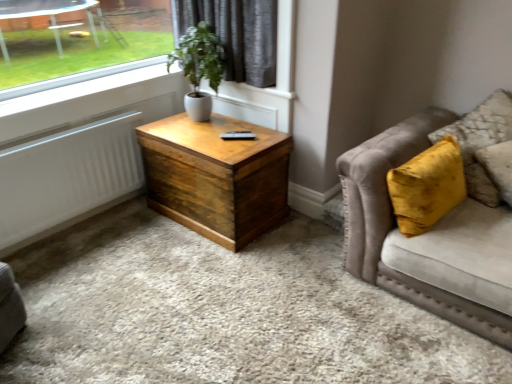
In order to face white ceramic pot at upper center, should I rotate leftwards or rightwards?

Turn left by 7.869 degrees to look at white ceramic pot at upper center.

This screenshot has height=384, width=512. What do you see at coordinates (199, 67) in the screenshot?
I see `white ceramic pot at upper center` at bounding box center [199, 67].

Measure the distance between wooden chest at center and camera.

wooden chest at center and camera are 2.24 meters apart.

This screenshot has height=384, width=512. In order to click on velvet yellow pillow at right in this screenshot , I will do `click(481, 142)`.

What's the angular difference between white ceramic pot at upper center and velvet yellow pillow at right's facing directions?

22.1 degrees.

From the image's perspective, is white ceramic pot at upper center beneath velvet yellow pillow at right?

Actually, white ceramic pot at upper center appears above velvet yellow pillow at right in the image.

Considering the relative sizes of white ceramic pot at upper center and velvet yellow pillow at right in the image provided, is white ceramic pot at upper center taller than velvet yellow pillow at right?

Incorrect, the height of white ceramic pot at upper center is not larger of that of velvet yellow pillow at right.

Is white ceramic pot at upper center to the left of velvet yellow pillow at right from the viewer's perspective?

Correct, you'll find white ceramic pot at upper center to the left of velvet yellow pillow at right.

Which of these two, velvet beige couch at right or white ceramic pot at upper center, stands shorter?

white ceramic pot at upper center.

Is velvet beige couch at right positioned with its back to white ceramic pot at upper center?

velvet beige couch at right is not turned away from white ceramic pot at upper center.

From the image's perspective, relative to white ceramic pot at upper center, is velvet beige couch at right above or below?

From the image's perspective, velvet beige couch at right appears below white ceramic pot at upper center.

Which of these two, wooden chest at center or velvet beige couch at right, is bigger?

velvet beige couch at right.

Choose the correct answer: Is wooden chest at center inside velvet beige couch at right or outside it?

wooden chest at center is spatially situated outside velvet beige couch at right.

Which is more to the right, wooden chest at center or velvet beige couch at right?

velvet beige couch at right.

From a real-world perspective, which object stands above the other?

From a 3D spatial view, velvet beige couch at right is above.

Which object is closer to the camera, wooden chest at center or velvet yellow pillow at right?

Positioned in front is velvet yellow pillow at right.

Consider the image. Which is nearer, (230, 159) or (479, 186)?

Clearly, point (230, 159) is more distant from the camera than point (479, 186).

From the image's perspective, which one is positioned lower, wooden chest at center or velvet yellow pillow at right?

From the image's view, wooden chest at center is below.

Consider the image. Does wooden chest at center have a lesser width compared to white matte radiator at left?

Incorrect, the width of wooden chest at center is not less than that of white matte radiator at left.

Consider the image. From their relative heights in the image, would you say wooden chest at center is taller or shorter than white matte radiator at left?

wooden chest at center is taller than white matte radiator at left.

Is wooden chest at center bigger than white matte radiator at left?

Yes.

Looking at this image, from the image's perspective, is wooden chest at center on top of white matte radiator at left?

Yes, from the image's perspective, wooden chest at center is above white matte radiator at left.

Can you confirm if velvet beige couch at right is positioned to the right of velvet yellow pillow at right?

No, velvet beige couch at right is not to the right of velvet yellow pillow at right.

How far apart are velvet beige couch at right and velvet yellow pillow at right?

10.18 inches.

Considering the relative sizes of velvet beige couch at right and velvet yellow pillow at right in the image provided, is velvet beige couch at right bigger than velvet yellow pillow at right?

Indeed, velvet beige couch at right has a larger size compared to velvet yellow pillow at right.

Can you tell me how much velvet beige couch at right and velvet yellow pillow at right differ in facing direction?

22.1 degrees separate the facing orientations of velvet beige couch at right and velvet yellow pillow at right.

Are white ceramic pot at upper center and white matte radiator at left located far from each other?

That's not correct — white ceramic pot at upper center is a little close to white matte radiator at left.

Can we say white ceramic pot at upper center lies outside white matte radiator at left?

Absolutely, white ceramic pot at upper center is external to white matte radiator at left.

Based on the photo, is white ceramic pot at upper center oriented towards white matte radiator at left?

Yes, white ceramic pot at upper center faces towards white matte radiator at left.

Find the location of a particular element. This screenshot has height=384, width=512. houseplant above the velvet yellow pillow at right (from the image's perspective) is located at coordinates (199, 67).

Where is `studio couch in front of the white ceramic pot at upper center`? The width and height of the screenshot is (512, 384). studio couch in front of the white ceramic pot at upper center is located at coordinates (435, 225).

Which object lies nearer to the anchor point velvet beige couch at right, white matte radiator at left or velvet yellow pillow at right?

velvet yellow pillow at right.

Estimate the real-world distances between objects in this image. Which object is closer to wooden chest at center, white ceramic pot at upper center or white matte radiator at left?

white ceramic pot at upper center.

Consider the image. From the image, which object appears to be nearer to velvet yellow pillow at right, white matte radiator at left or wooden chest at center?

Based on the image, wooden chest at center appears to be nearer to velvet yellow pillow at right.

When comparing their distances from velvet beige couch at right, does velvet yellow pillow at right or white matte radiator at left seem further?

white matte radiator at left.

Considering their positions, is white matte radiator at left positioned further to velvet yellow pillow at right than white ceramic pot at upper center?

Based on the image, white matte radiator at left appears to be further to velvet yellow pillow at right.

Looking at the image, which one is located further to white matte radiator at left, velvet yellow pillow at right or velvet beige couch at right?

velvet yellow pillow at right.

In the scene shown: Based on their spatial positions, is velvet beige couch at right or wooden chest at center closer to velvet yellow pillow at right?

velvet beige couch at right lies closer to velvet yellow pillow at right than the other object.

Consider the image. Considering their positions, is wooden chest at center positioned closer to velvet yellow pillow at right than velvet beige couch at right?

→ velvet beige couch at right.

Find the location of a particular element. studio couch between wooden chest at center and velvet yellow pillow at right from left to right is located at coordinates (435, 225).

The image size is (512, 384). Identify the location of houseplant between white matte radiator at left and velvet yellow pillow at right. (199, 67).

Locate an element on the screen. This screenshot has width=512, height=384. studio couch between white matte radiator at left and velvet yellow pillow at right is located at coordinates (435, 225).

Where is `houseplant located between white matte radiator at left and velvet beige couch at right in the left-right direction`? Image resolution: width=512 pixels, height=384 pixels. houseplant located between white matte radiator at left and velvet beige couch at right in the left-right direction is located at coordinates (199, 67).